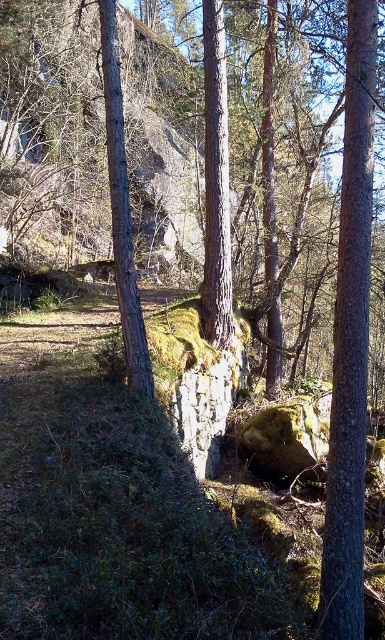
You are standing in the forest and see two tree trunks. One is the smooth brown tree trunk at right and the other is the smooth bark tree trunk at center. Which one is positioned more to the east if the sun is setting in the west?

The smooth brown tree trunk at right is positioned to the right of the smooth bark tree trunk at center. Since the sun is setting in the west, shadows would be cast to the east. If the smooth brown tree trunk at right is casting a shadow to its left towards the center, it would be positioned more to the west, making the smooth bark tree trunk at center closer to the east. However, without specific shadow direction details, we can only state their relative positions. The smooth brown tree trunk at right is 1

You are standing at the center of the image and want to walk towards the smooth brown tree trunk at right. Which direction should you face to head directly towards it?

To head directly towards the smooth brown tree trunk at right, you should face towards the right since its 2D location is at point (351, 342), which is positioned to the right side of the image.